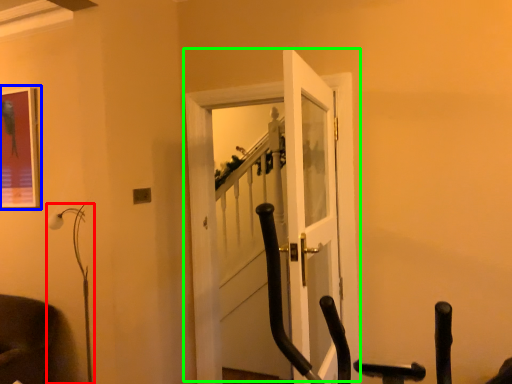
Question: Considering the real-world distances, which object is farthest from lamp (highlighted by a red box)? picture frame (highlighted by a blue box) or door (highlighted by a green box)?

Choices:
 (A) picture frame
 (B) door

Answer: (B)